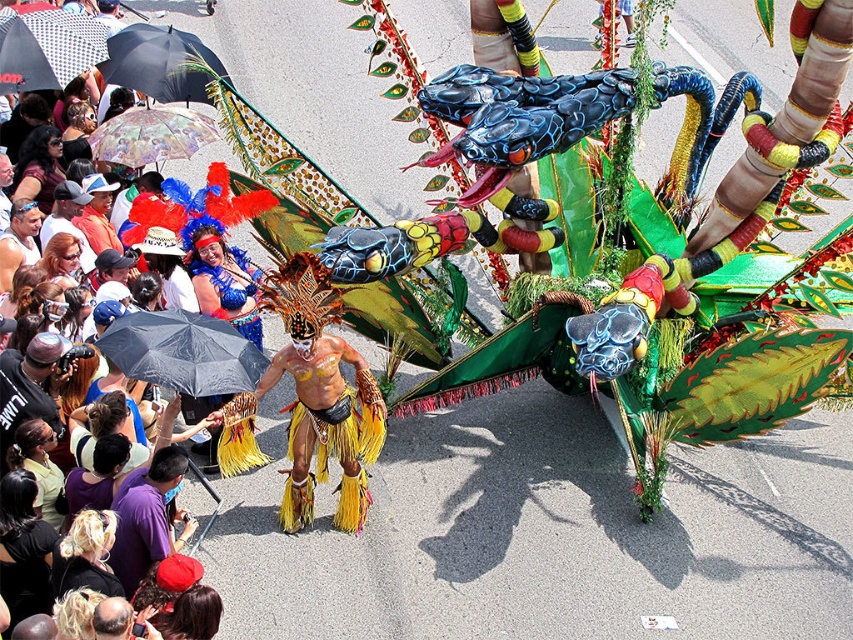
You are a photographer standing at the point marked as point (311, 401). You want to capture the performer in their yellow fringed skirt at center. Is the point located on the performer?

Yes, the point (311, 401) is on the yellow fringed skirt at center, which is part of the performer, so the point is located on the performer.

You are standing at the point with coordinates point [173,124] and want to see the performer in front of the float. Is the performer at point [294,435] blocking your view?

Point [294,435] is in front of point [173,124], so yes, the performer at point [294,435] is blocking your view.